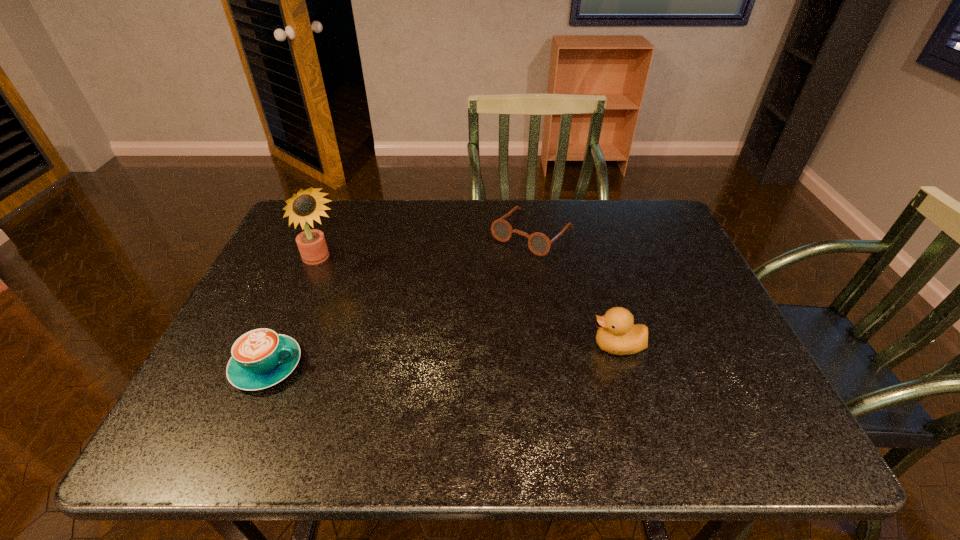
Find the location of a particular element. cappuccino is located at coordinates (261, 358).

Where is `the third shortest object`? This screenshot has width=960, height=540. the third shortest object is located at coordinates (617, 334).

The height and width of the screenshot is (540, 960). What are the coordinates of `sunflower` in the screenshot? It's located at (303, 207).

Where is `spectacles`? spectacles is located at coordinates (539, 244).

Locate an element on the screen. free location located with the handle on the right side of the cappuccino is located at coordinates (397, 366).

At what (x,y) coordinates should I click in order to perform the action: click on vacant space located 0.230m facing forward on the third shortest object. Please return your answer as a coordinate pair (x, y). The height and width of the screenshot is (540, 960). Looking at the image, I should click on (489, 346).

I want to click on vacant region located 0.310m facing forward on the third shortest object, so coord(453,346).

Find the location of a particular element. vacant space situated 0.300m facing forward on the third shortest object is located at coordinates (458, 346).

Locate an element on the screen. The height and width of the screenshot is (540, 960). vacant space located on the face of the sunflower is located at coordinates (361, 308).

You are a GUI agent. You are given a task and a screenshot of the screen. Output one action in this format:
    pyautogui.click(x=<x>, y=<y>)
    Task: Click on the blank space located 0.060m on the face of the sunflower
    
    Given the screenshot: What is the action you would take?
    pyautogui.click(x=343, y=287)